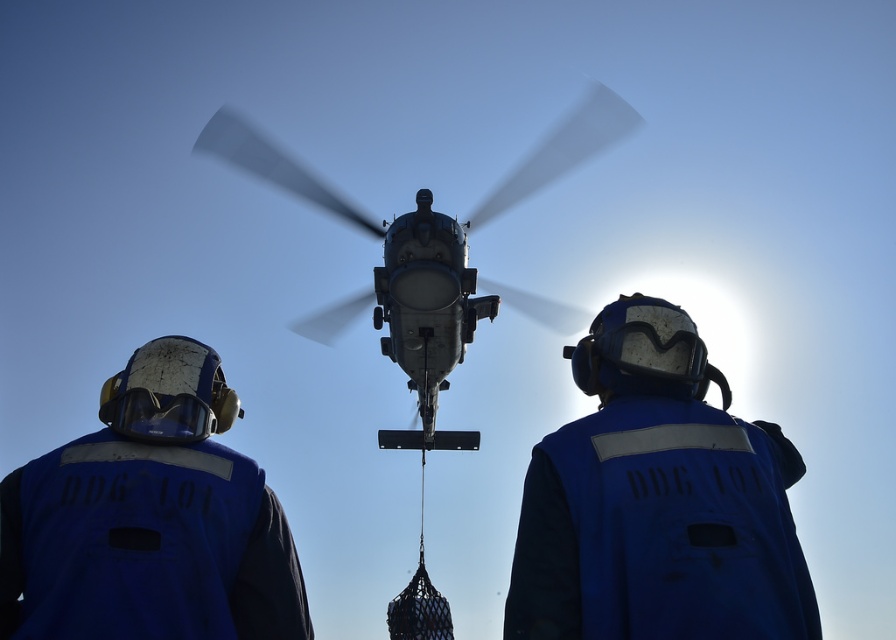
Is blue fabric helmet at center shorter than blue matte vest at center?

In fact, blue fabric helmet at center may be taller than blue matte vest at center.

Does point (588, 381) lie behind point (145, 429)?

Yes, it is.

Find the location of `blue fabric helmet at center`. blue fabric helmet at center is located at coordinates (657, 500).

Is point (412, 272) less distant than point (152, 401)?

That is False.

Can you confirm if metallic gray helicopter at center is positioned below transparent plastic goggles at center?

No, metallic gray helicopter at center is not below transparent plastic goggles at center.

This screenshot has width=896, height=640. What do you see at coordinates (431, 253) in the screenshot?
I see `metallic gray helicopter at center` at bounding box center [431, 253].

At what (x,y) coordinates should I click in order to perform the action: click on metallic gray helicopter at center. Please return your answer as a coordinate pair (x, y). This screenshot has height=640, width=896. Looking at the image, I should click on (431, 253).

Which of these two, blue fabric helmet at center or transparent plastic goggles at center, stands taller?

blue fabric helmet at center is taller.

Which is in front, point (596, 368) or point (138, 404)?

Point (138, 404) is in front.

At what (x,y) coordinates should I click in order to perform the action: click on blue fabric helmet at center. Please return your answer as a coordinate pair (x, y). The width and height of the screenshot is (896, 640). Looking at the image, I should click on tap(657, 500).